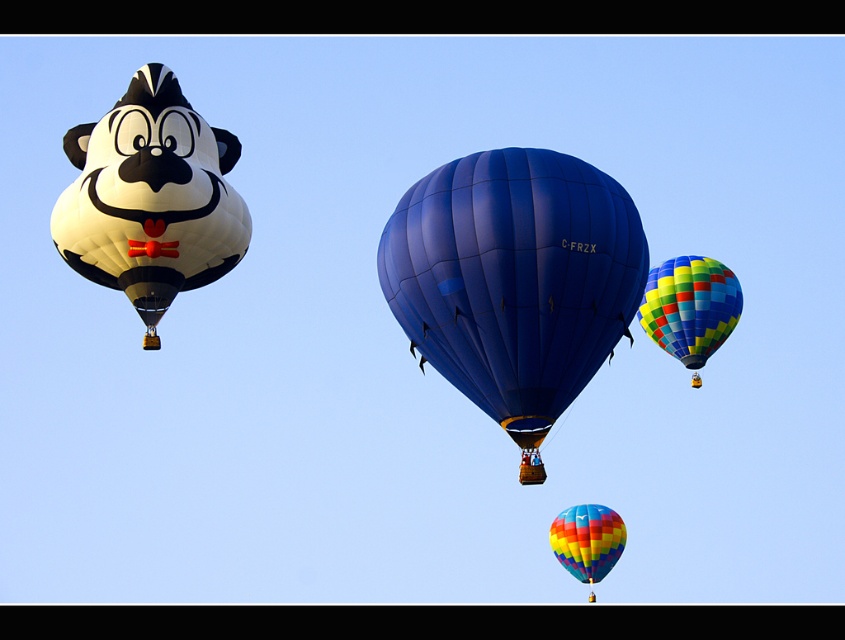
Question: Is white matte balloon at left closer to camera compared to multicolored fabric hot air balloon at upper right?

Choices:
 (A) no
 (B) yes

Answer: (B)

Question: Which point is closer to the camera?

Choices:
 (A) (668, 339)
 (B) (574, 529)
 (C) (161, 232)

Answer: (C)

Question: Considering the relative positions of white matte balloon at left and rainbow striped hot air balloon at lower center in the image provided, where is white matte balloon at left located with respect to rainbow striped hot air balloon at lower center?

Choices:
 (A) right
 (B) left

Answer: (B)

Question: Can you confirm if blue glossy hot air balloon at center is wider than rainbow striped hot air balloon at lower center?

Choices:
 (A) no
 (B) yes

Answer: (B)

Question: Which point is farther from the camera taking this photo?

Choices:
 (A) (540, 252)
 (B) (189, 259)
 (C) (562, 516)
 (D) (712, 312)

Answer: (C)

Question: Estimate the real-world distances between objects in this image. Which object is farther from the blue glossy hot air balloon at center?

Choices:
 (A) white matte balloon at left
 (B) rainbow striped hot air balloon at lower center

Answer: (B)